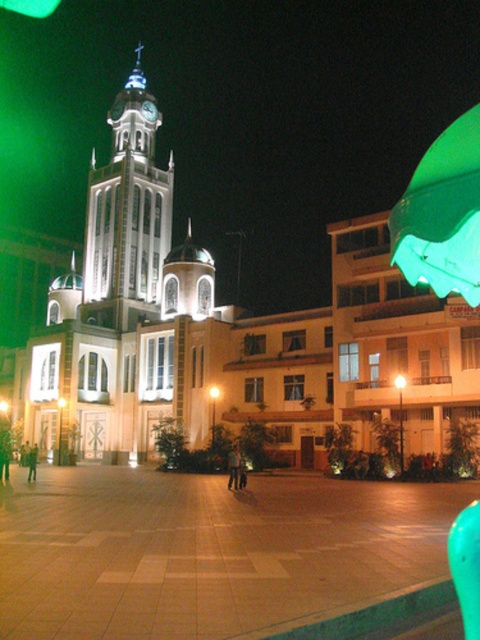
Does smooth stone pavement at center have a greater width compared to green fabric umbrella at upper right?

Yes, smooth stone pavement at center is wider than green fabric umbrella at upper right.

Who is positioned more to the left, smooth stone pavement at center or green fabric umbrella at upper right?

Positioned to the left is smooth stone pavement at center.

The width and height of the screenshot is (480, 640). I want to click on smooth stone pavement at center, so click(208, 550).

You are a GUI agent. You are given a task and a screenshot of the screen. Output one action in this format:
    pyautogui.click(x=<x>, y=<y>)
    Task: Click on the smooth stone pavement at center
    
    Given the screenshot: What is the action you would take?
    pyautogui.click(x=208, y=550)

Is point (158, 109) more distant than point (464, 124)?

Yes.

Which is more to the left, white glass clock tower at center or green fabric umbrella at upper right?

white glass clock tower at center

The image size is (480, 640). Describe the element at coordinates (127, 211) in the screenshot. I see `white glass clock tower at center` at that location.

Where is `white glass clock tower at center`? This screenshot has width=480, height=640. white glass clock tower at center is located at coordinates (127, 211).

Who is lower down, smooth stone pavement at center or white glass clock tower at center?

Positioned lower is smooth stone pavement at center.

Who is positioned more to the left, smooth stone pavement at center or white glass clock tower at center?

white glass clock tower at center is more to the left.

You are a GUI agent. You are given a task and a screenshot of the screen. Output one action in this format:
    pyautogui.click(x=<x>, y=<y>)
    Task: Click on the smooth stone pavement at center
    The width and height of the screenshot is (480, 640).
    Given the screenshot: What is the action you would take?
    pyautogui.click(x=208, y=550)